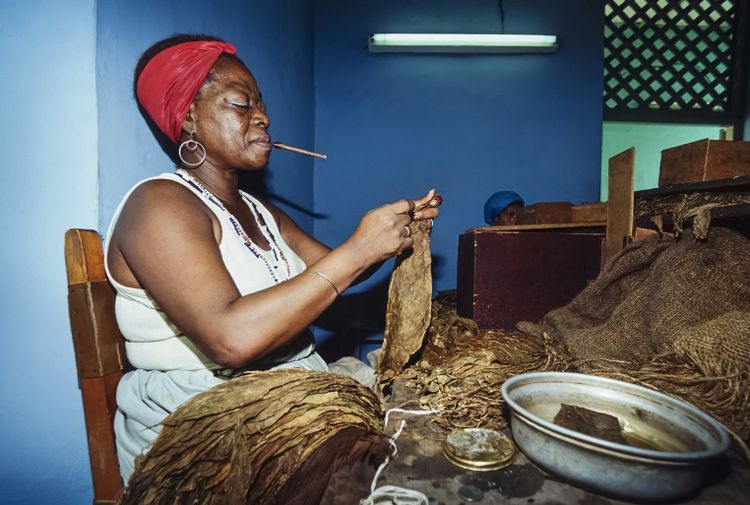
Locate an element on the screen. green wall is located at coordinates (624, 134).